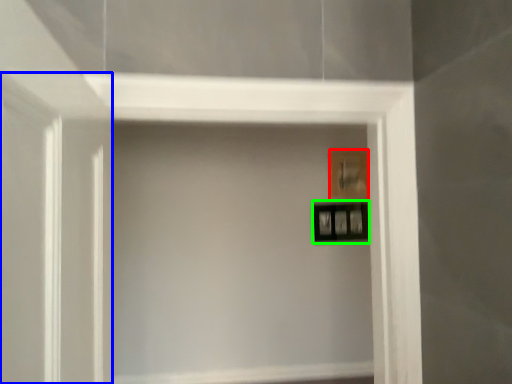
Question: Which object is the farthest from picture frame (highlighted by a red box)? Choose among these: glass door (highlighted by a blue box) or picture frame (highlighted by a green box).

Choices:
 (A) glass door
 (B) picture frame

Answer: (A)